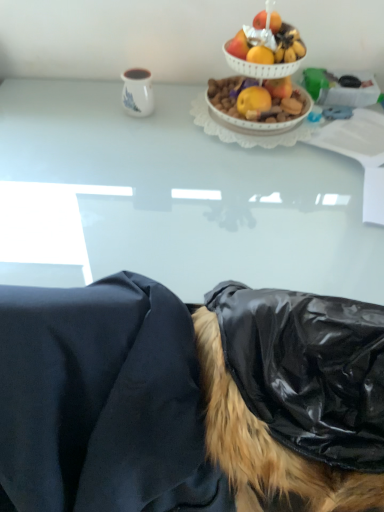
Question: Is point pos(244,122) closer or farther from the camera than point pos(77,168)?

Choices:
 (A) farther
 (B) closer

Answer: (A)

Question: Considering their positions, is shiny white bowl at upper center located in front of or behind white glossy table at upper center?

Choices:
 (A) front
 (B) behind

Answer: (B)

Question: Which object is positioned farthest from the black fabric at lower center?

Choices:
 (A) black glossy wig at lower right
 (B) white ceramic mug at upper center
 (C) white glossy table at upper center
 (D) shiny white bowl at upper center

Answer: (B)

Question: Which of these objects is positioned farthest from the black glossy wig at lower right?

Choices:
 (A) white ceramic mug at upper center
 (B) shiny white bowl at upper center
 (C) black fabric at lower center
 (D) white glossy table at upper center

Answer: (A)